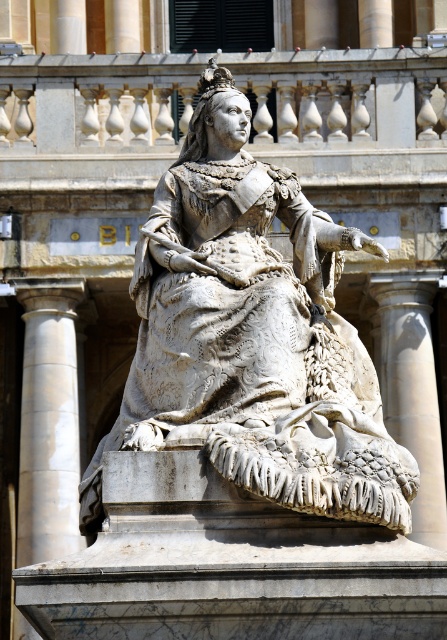
Question: Among these points, which one is farthest from the camera?

Choices:
 (A) (197, 144)
 (B) (42, 358)
 (C) (438, 461)

Answer: (B)

Question: Is white marble column at left in front of white marble column at right?

Choices:
 (A) yes
 (B) no

Answer: (B)

Question: Among these points, which one is farthest from the camera?

Choices:
 (A) (71, 452)
 (B) (425, 301)

Answer: (B)

Question: Is white marble column at left below white marble column at right?

Choices:
 (A) yes
 (B) no

Answer: (A)

Question: Is the position of white marble statue at center less distant than that of white marble column at left?

Choices:
 (A) yes
 (B) no

Answer: (A)

Question: Estimate the real-world distances between objects in this image. Which object is closer to the white marble column at left?

Choices:
 (A) white marble statue at center
 (B) white marble column at right

Answer: (B)